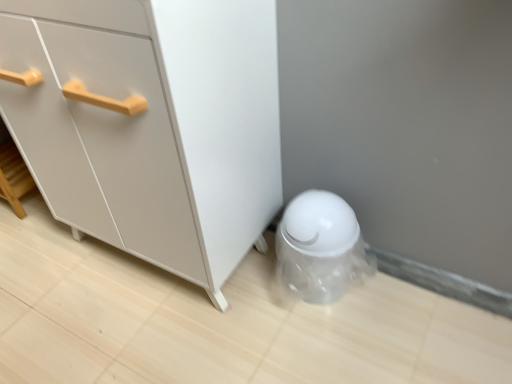
What is the approximate height of white matte cabinet at center?

The height of white matte cabinet at center is 31.91 inches.

Identify the location of white matte cabinet at center. (151, 124).

This screenshot has height=384, width=512. What do you see at coordinates (151, 124) in the screenshot?
I see `white matte cabinet at center` at bounding box center [151, 124].

The width and height of the screenshot is (512, 384). Describe the element at coordinates (321, 247) in the screenshot. I see `transparent plastic trash can at lower right` at that location.

The image size is (512, 384). I want to click on transparent plastic trash can at lower right, so click(321, 247).

Identify the location of white matte cabinet at center. (151, 124).

Between transparent plastic trash can at lower right and white matte cabinet at center, which one appears on the left side from the viewer's perspective?

Positioned to the left is white matte cabinet at center.

Which is behind, transparent plastic trash can at lower right or white matte cabinet at center?

transparent plastic trash can at lower right.

Which point is more forward, (312, 196) or (205, 122)?

The point (205, 122) is in front.

From the image's perspective, is transparent plastic trash can at lower right positioned above or below white matte cabinet at center?

From the image's perspective, transparent plastic trash can at lower right appears below white matte cabinet at center.

In the scene shown: From a real-world perspective, is transparent plastic trash can at lower right under white matte cabinet at center?

Indeed, from a real-world perspective, transparent plastic trash can at lower right is positioned beneath white matte cabinet at center.

In terms of width, does transparent plastic trash can at lower right look wider or thinner when compared to white matte cabinet at center?

transparent plastic trash can at lower right is thinner than white matte cabinet at center.

Can you confirm if transparent plastic trash can at lower right is shorter than white matte cabinet at center?

Indeed, transparent plastic trash can at lower right has a lesser height compared to white matte cabinet at center.

Is transparent plastic trash can at lower right bigger or smaller than white matte cabinet at center?

In the image, transparent plastic trash can at lower right appears to be smaller than white matte cabinet at center.

Is transparent plastic trash can at lower right inside or outside of white matte cabinet at center?

transparent plastic trash can at lower right lies outside white matte cabinet at center.

Is transparent plastic trash can at lower right far from white matte cabinet at center?

No, transparent plastic trash can at lower right is not far away from white matte cabinet at center.

Does transparent plastic trash can at lower right turn towards white matte cabinet at center?

No.

Can you tell me how much transparent plastic trash can at lower right and white matte cabinet at center differ in facing direction?

transparent plastic trash can at lower right and white matte cabinet at center are facing 0.000148 degrees away from each other.

Measure the distance from transparent plastic trash can at lower right to white matte cabinet at center.

A distance of 13.49 inches exists between transparent plastic trash can at lower right and white matte cabinet at center.

The image size is (512, 384). Find the location of `chest of drawers above the transparent plastic trash can at lower right (from a real-world perspective)`. chest of drawers above the transparent plastic trash can at lower right (from a real-world perspective) is located at coordinates (151, 124).

Does white matte cabinet at center appear on the left side of transparent plastic trash can at lower right?

Yes.

Is the position of white matte cabinet at center more distant than that of transparent plastic trash can at lower right?

No, the depth of white matte cabinet at center is less than that of transparent plastic trash can at lower right.

Which point is more distant from viewer, (206,27) or (364,269)?

The point (364,269) is behind.

From the image's perspective, does white matte cabinet at center appear higher than transparent plastic trash can at lower right?

Correct, white matte cabinet at center appears higher than transparent plastic trash can at lower right in the image.

From a real-world perspective, which object stands above the other?

In real-world perspective, white matte cabinet at center is above.

Considering the sizes of white matte cabinet at center and transparent plastic trash can at lower right in the image, is white matte cabinet at center wider or thinner than transparent plastic trash can at lower right?

white matte cabinet at center is wider than transparent plastic trash can at lower right.

Is white matte cabinet at center taller or shorter than transparent plastic trash can at lower right?

Considering their sizes, white matte cabinet at center has more height than transparent plastic trash can at lower right.

Looking at the image, does white matte cabinet at center seem bigger or smaller compared to transparent plastic trash can at lower right?

Clearly, white matte cabinet at center is larger in size than transparent plastic trash can at lower right.

Would you say transparent plastic trash can at lower right is part of white matte cabinet at center's contents?

Actually, transparent plastic trash can at lower right is outside white matte cabinet at center.

Are white matte cabinet at center and transparent plastic trash can at lower right making contact?

No, white matte cabinet at center is not touching transparent plastic trash can at lower right.

Could you tell me if white matte cabinet at center is turned towards transparent plastic trash can at lower right?

No, white matte cabinet at center does not turn towards transparent plastic trash can at lower right.

Can you tell me how much white matte cabinet at center and transparent plastic trash can at lower right differ in facing direction?

The facing directions of white matte cabinet at center and transparent plastic trash can at lower right are 0.000148 degrees apart.

Measure the distance between white matte cabinet at center and transparent plastic trash can at lower right.

A distance of 13.49 inches exists between white matte cabinet at center and transparent plastic trash can at lower right.

The width and height of the screenshot is (512, 384). I want to click on chest of drawers on the left of the transparent plastic trash can at lower right, so click(151, 124).

Locate an element on the screen. the chest of drawers above the transparent plastic trash can at lower right (from a real-world perspective) is located at coordinates (151, 124).

This screenshot has height=384, width=512. Identify the location of porcelain that appears below the white matte cabinet at center (from a real-world perspective). (321, 247).